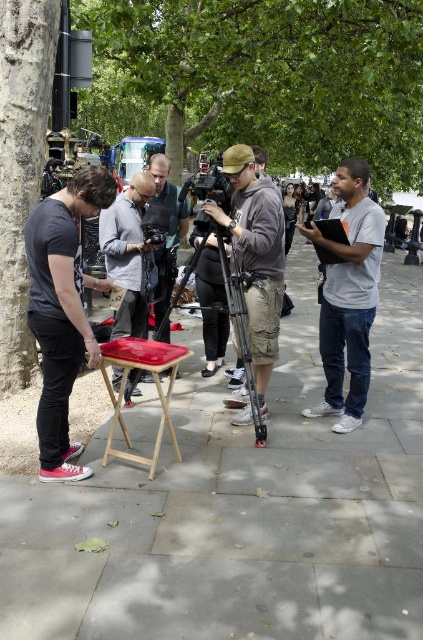
You are a photographer trying to set up your equipment. You have a matte gray shirt at center and a black plastic video camera at center. Which object should you move first if you need to create more space on the surface?

The matte gray shirt at center might be wider than the black plastic video camera at center, so moving the matte gray shirt at center first would create more space.

You are a photographer setting up equipment in the park. You have a matte black tripod at center and a green leafy tree at upper center in your view. Which object is positioned higher in the frame?

The green leafy tree at upper center is positioned higher in the frame than the matte black tripod at center.